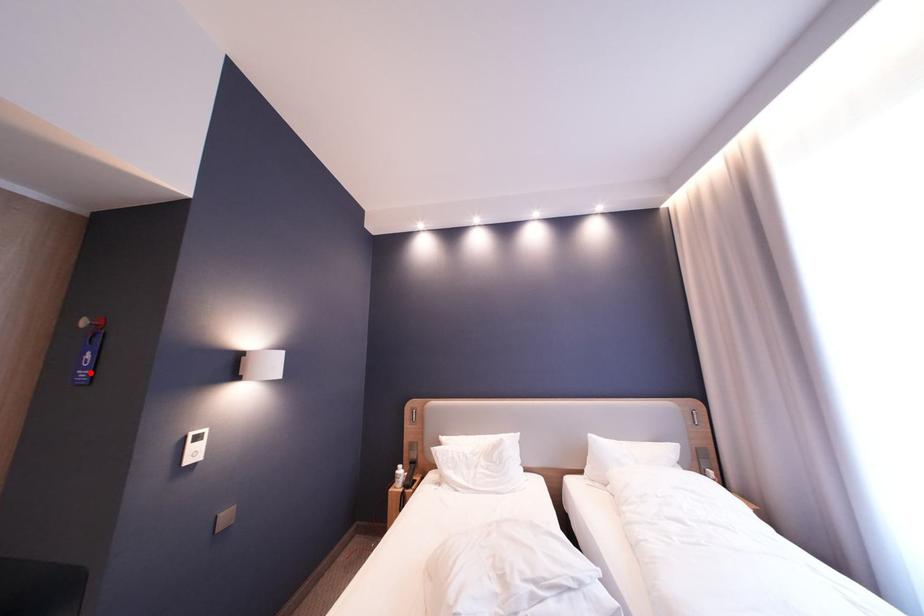
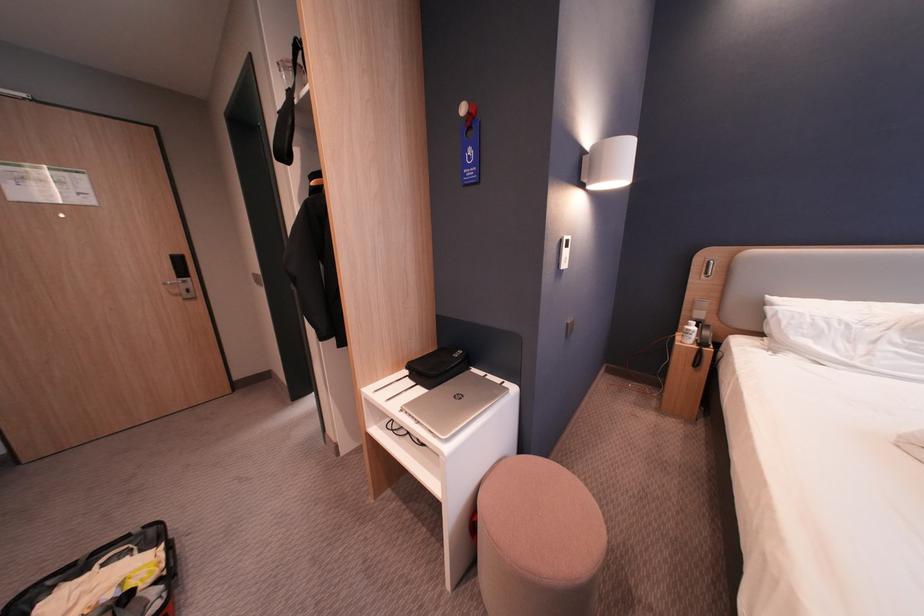
Question: I am providing you with two images of the same scene from different viewpoints. A red point is marked on the first image. Can you still see the location of the red point in image 2?

Choices:
 (A) Yes
 (B) No

Answer: (A)